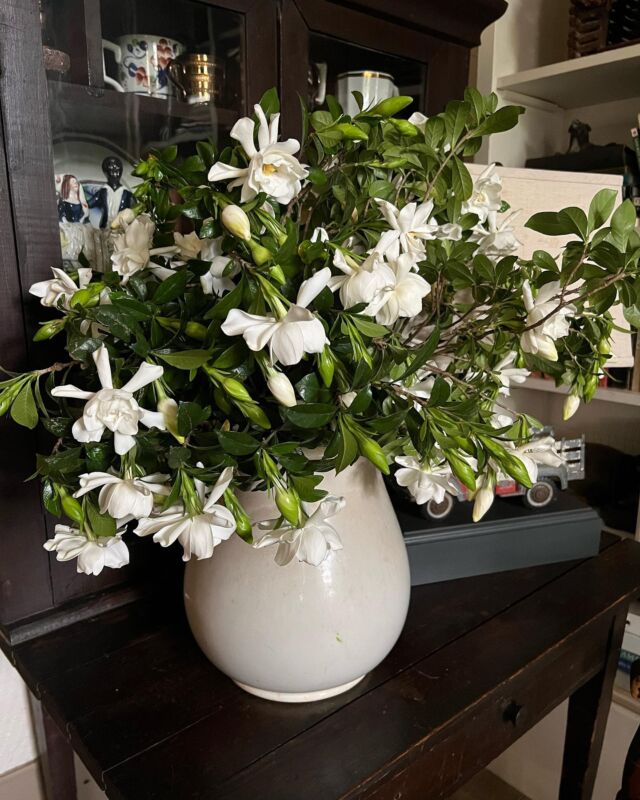
At what (x,y) coordinates should I click in order to perform the action: click on legs of table. Please return your answer as a coordinate pair (x, y). Looking at the image, I should click on (584, 708), (54, 766).